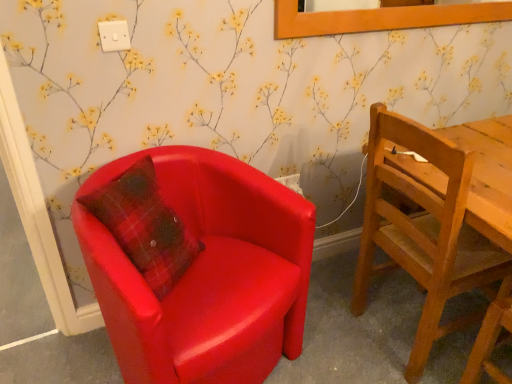
Question: From the image's perspective, is matte red armchair at left, arranged as the first chair when viewed from the left, located beneath white plastic power outlet at upper center, the first power outlet when ordered from top to bottom?

Choices:
 (A) yes
 (B) no

Answer: (A)

Question: Is matte red armchair at left, acting as the 2th chair starting from the right, not inside white plastic power outlet at upper center, the first power outlet viewed from the left?

Choices:
 (A) yes
 (B) no

Answer: (A)

Question: From a real-world perspective, is matte red armchair at left, arranged as the first chair when viewed from the left, positioned under white plastic power outlet at upper center, the 2th power outlet when ordered from back to front, based on gravity?

Choices:
 (A) yes
 (B) no

Answer: (A)

Question: Considering the relative sizes of matte red armchair at left, arranged as the first chair when viewed from the left, and white plastic power outlet at upper center, the second power outlet from the right, in the image provided, is matte red armchair at left, arranged as the first chair when viewed from the left, wider than white plastic power outlet at upper center, the second power outlet from the right,?

Choices:
 (A) yes
 (B) no

Answer: (A)

Question: Is matte red armchair at left, arranged as the first chair when viewed from the left, next to white plastic power outlet at upper center, which ranks as the 2th power outlet in bottom-to-top order, and touching it?

Choices:
 (A) yes
 (B) no

Answer: (B)

Question: From the image's perspective, is white plastic power outlet at lower center, which is counted as the second power outlet, starting from the left, positioned above or below white plastic power outlet at upper center, the first power outlet viewed from the left?

Choices:
 (A) above
 (B) below

Answer: (B)

Question: In the image, is white plastic power outlet at lower center, which is the 2th power outlet from top to bottom, positioned in front of or behind white plastic power outlet at upper center, acting as the 1th power outlet starting from the front?

Choices:
 (A) behind
 (B) front

Answer: (A)

Question: Is white plastic power outlet at lower center, which is counted as the second power outlet, starting from the left, wider or thinner than white plastic power outlet at upper center, acting as the 1th power outlet starting from the front?

Choices:
 (A) wide
 (B) thin

Answer: (A)

Question: Considering the positions of point (295, 182) and point (118, 36), is point (295, 182) closer or farther from the camera than point (118, 36)?

Choices:
 (A) farther
 (B) closer

Answer: (A)

Question: Do you think white plastic power outlet at upper center, the first power outlet when ordered from top to bottom, is within matte red armchair at left, acting as the 2th chair starting from the right, or outside of it?

Choices:
 (A) inside
 (B) outside

Answer: (B)

Question: Is point tap(105, 44) positioned closer to the camera than point tap(123, 367)?

Choices:
 (A) farther
 (B) closer

Answer: (A)

Question: In terms of width, does white plastic power outlet at upper center, the second power outlet from the right, look wider or thinner when compared to matte red armchair at left, acting as the 2th chair starting from the right?

Choices:
 (A) thin
 (B) wide

Answer: (A)

Question: From a real-world perspective, is white plastic power outlet at upper center, the first power outlet when ordered from top to bottom, physically located above or below matte red armchair at left, arranged as the first chair when viewed from the left?

Choices:
 (A) below
 (B) above

Answer: (B)

Question: In the image, is white plastic power outlet at upper center, the second power outlet from the right, positioned in front of or behind white plastic power outlet at lower center, which ranks as the first power outlet in back-to-front order?

Choices:
 (A) front
 (B) behind

Answer: (A)

Question: Considering the positions of white plastic power outlet at upper center, the second power outlet from the right, and white plastic power outlet at lower center, which ranks as the first power outlet in back-to-front order, in the image, is white plastic power outlet at upper center, the second power outlet from the right, wider or thinner than white plastic power outlet at lower center, which ranks as the first power outlet in back-to-front order,?

Choices:
 (A) thin
 (B) wide

Answer: (A)